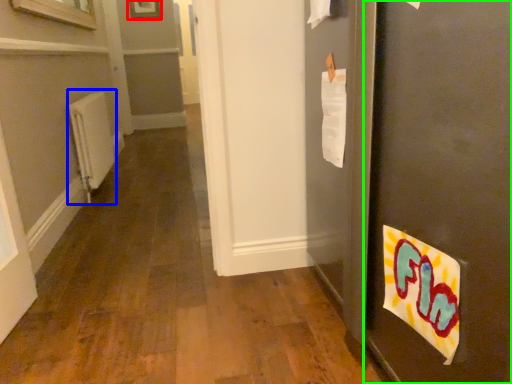
Question: Based on their relative distances, which object is nearer to picture frame (highlighted by a red box)? Choose from radiator (highlighted by a blue box) and door (highlighted by a green box).

Choices:
 (A) radiator
 (B) door

Answer: (A)